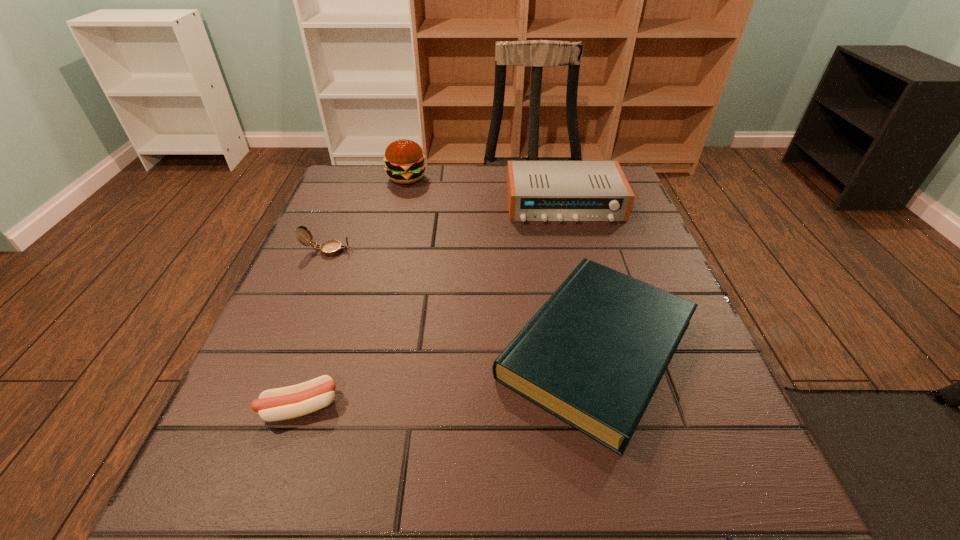
In order to click on the tallest object in this screenshot , I will do `click(404, 159)`.

Find the location of a particular element. This screenshot has width=960, height=540. radio receiver is located at coordinates (560, 191).

Find the location of a particular element. the third nearest object is located at coordinates (330, 248).

I want to click on book, so click(x=593, y=355).

This screenshot has height=540, width=960. Find the location of `the shortest object`. the shortest object is located at coordinates (284, 403).

Identify the location of vacant space located 0.120m on the left of the hamburger. (343, 178).

The width and height of the screenshot is (960, 540). I want to click on free space located 0.400m on the control panel of the radio receiver, so click(x=605, y=358).

Image resolution: width=960 pixels, height=540 pixels. Identify the location of vacant space situated 0.120m on the face of the compass. (406, 251).

Where is `vacant space situated 0.280m on the left of the book`? This screenshot has height=540, width=960. vacant space situated 0.280m on the left of the book is located at coordinates (333, 350).

Identify the location of vacant region located 0.110m on the right of the sausage. (407, 407).